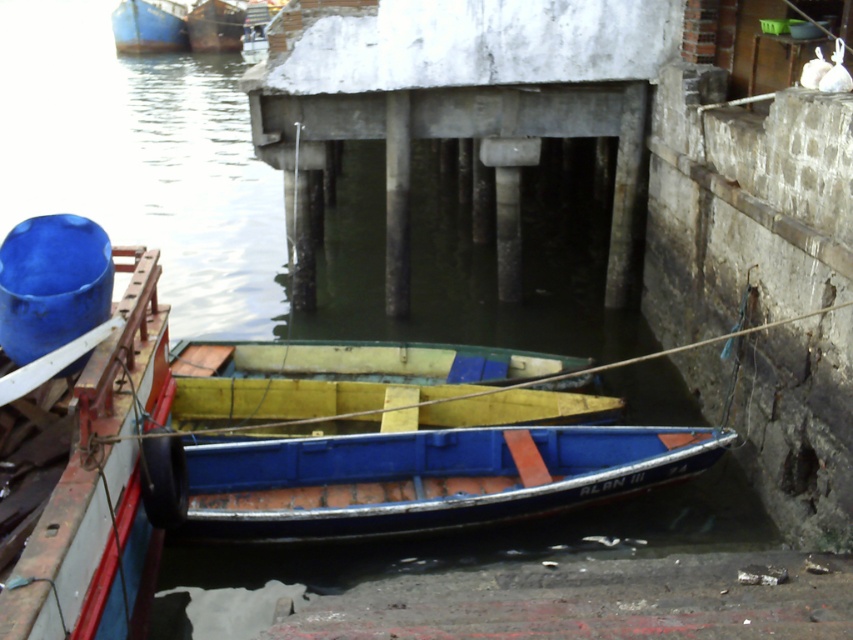
You are planning to store both the blue painted wood canoe at center and the yellow matte canoe at center in a storage shed with a height limit of 1.2 meters. Given their heights, which canoe would require a taller storage space?

The blue painted wood canoe at center has a greater height compared to the yellow matte canoe at center, so it would require a taller storage space.

You are standing on the dock and want to board the blue painted wood canoe at center. Which direction should you walk from the yellow matte canoe at center to reach it?

The blue painted wood canoe at center is positioned on the right side of the yellow matte canoe at center, so you should walk to the right from the yellow matte canoe at center to reach it.

You are standing at the point with coordinates (78, 433) in the image. What object is directly in front of you?

The point at coordinates (78, 433) corresponds to the smooth blue boat at left, so the object directly in front is the smooth blue boat at left.